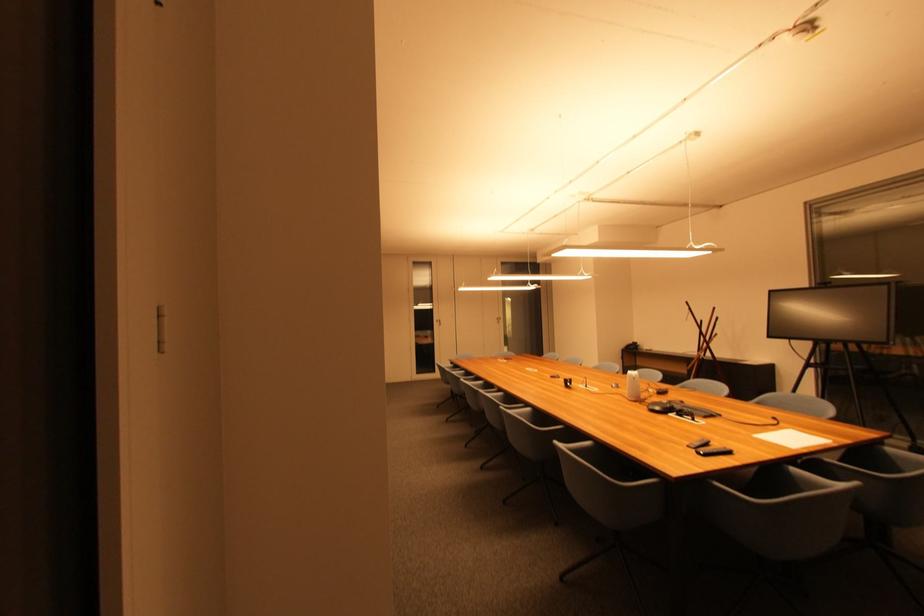
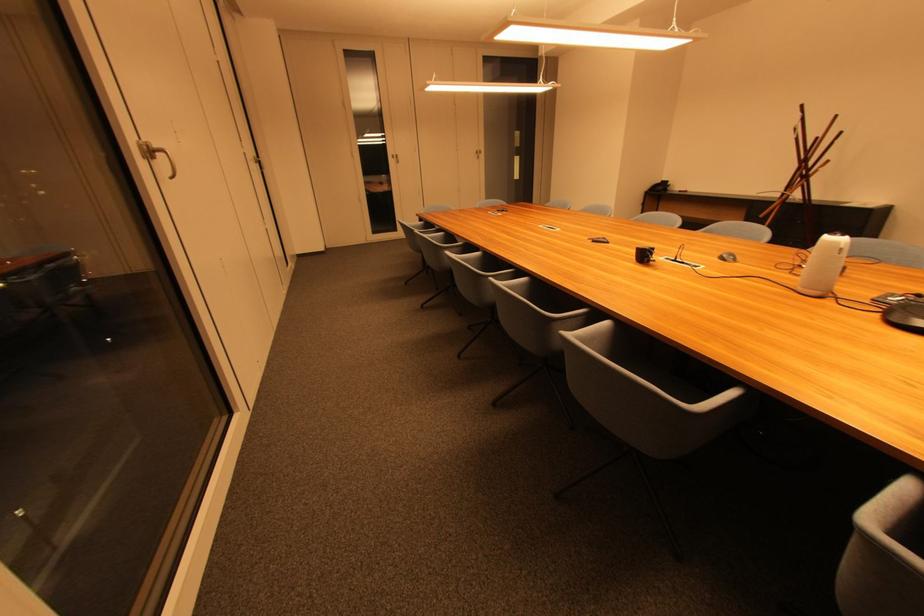
Find the pixel in the second image that matches the point at 535,411 in the first image.

(612, 325)